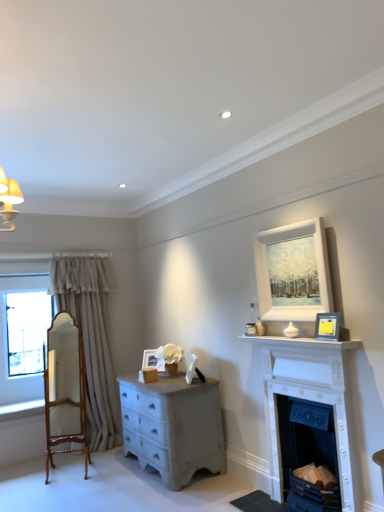
Question: From a real-world perspective, is white painted wood fireplace at lower right, which ranks as the second fireplace in top-to-bottom order, physically located above or below wooden polished mirror at left?

Choices:
 (A) above
 (B) below

Answer: (B)

Question: In terms of height, does white painted wood fireplace at lower right, the first fireplace ordered from the bottom, look taller or shorter compared to wooden polished mirror at left?

Choices:
 (A) short
 (B) tall

Answer: (A)

Question: Which of these objects is positioned farthest from the beige fabric curtain at left?

Choices:
 (A) white painted wood fireplace at lower right, the first fireplace ordered from the bottom
 (B) matte white picture frame at center, marked as the 1th picture frame in a left-to-right arrangement
 (C) white painted wood fireplace at right, which is the 2th fireplace in bottom-to-top order
 (D) white matte picture frame at center, which is the third picture frame in top-to-bottom order
 (E) black matte picture frame at upper right, placed as the fourth picture frame when sorted from left to right

Answer: (E)

Question: Which object is the farthest from the matte white picture frame at center, the first picture frame when ordered from bottom to top?

Choices:
 (A) white painted wood fireplace at lower right, the first fireplace ordered from the bottom
 (B) white painted wood mantle at upper center
 (C) beige fabric curtain at left
 (D) white painted wood fireplace at right, which is the 2th fireplace in bottom-to-top order
 (E) black matte picture frame at upper right, which is counted as the third picture frame, starting from the bottom

Answer: (E)